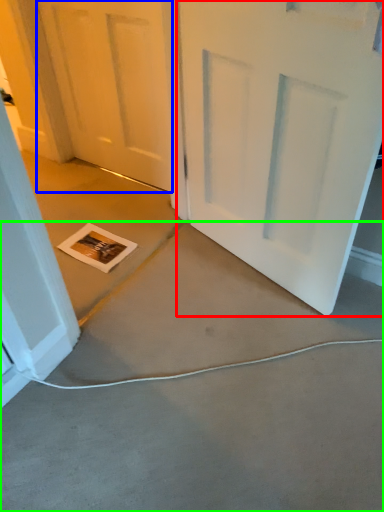
Question: Considering the real-world distances, which object is closest to door (highlighted by a red box)? door (highlighted by a blue box) or concrete (highlighted by a green box).

Choices:
 (A) door
 (B) concrete

Answer: (B)